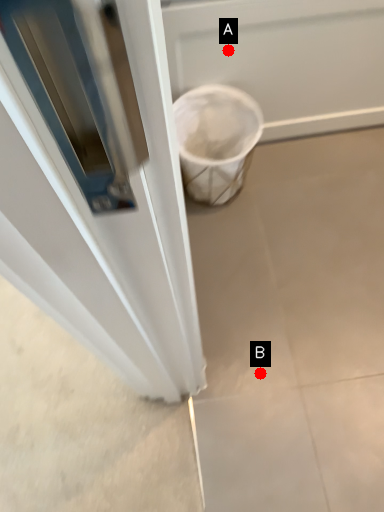
Question: Two points are circled on the image, labeled by A and B beside each circle. Which point appears closest to the camera in this image?

Choices:
 (A) A is closer
 (B) B is closer

Answer: (A)